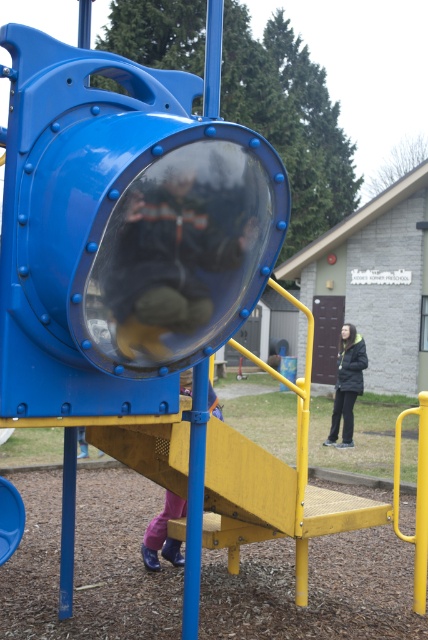
Where is `dark gray jacket at right`? dark gray jacket at right is located at coordinates (347, 385).

Can you confirm if dark gray jacket at right is taller than pink fabric pants at lower center?

Correct, dark gray jacket at right is much taller as pink fabric pants at lower center.

This screenshot has width=428, height=640. Describe the element at coordinates (347, 385) in the screenshot. I see `dark gray jacket at right` at that location.

What are the coordinates of `dark gray jacket at right` in the screenshot? It's located at click(x=347, y=385).

Does point (133, 209) come farther from viewer compared to point (350, 340)?

That is False.

Who is shorter, dark blue jacket at center or dark gray jacket at right?

dark blue jacket at center is shorter.

Is point (205, 312) in front of point (360, 353)?

Yes, it is in front of point (360, 353).

This screenshot has width=428, height=640. Identify the location of dark blue jacket at center. (178, 256).

Does dark blue jacket at center appear over pink fabric pants at lower center?

Correct, dark blue jacket at center is located above pink fabric pants at lower center.

Is dark blue jacket at center in front of pink fabric pants at lower center?

Yes, dark blue jacket at center is closer to the viewer.

The height and width of the screenshot is (640, 428). In order to click on dark blue jacket at center in this screenshot , I will do `click(178, 256)`.